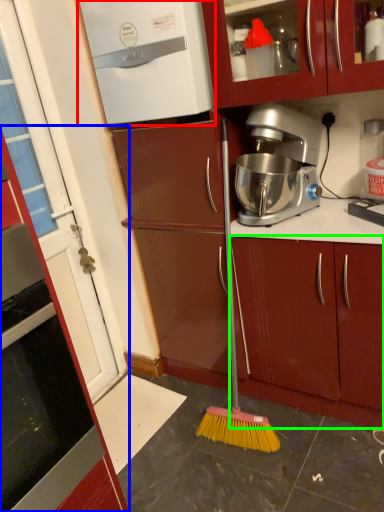
Question: Which object is positioned farthest from home appliance (highlighted by a red box)? Select from cabinetry (highlighted by a blue box) and cabinetry (highlighted by a green box).

Choices:
 (A) cabinetry
 (B) cabinetry

Answer: (A)